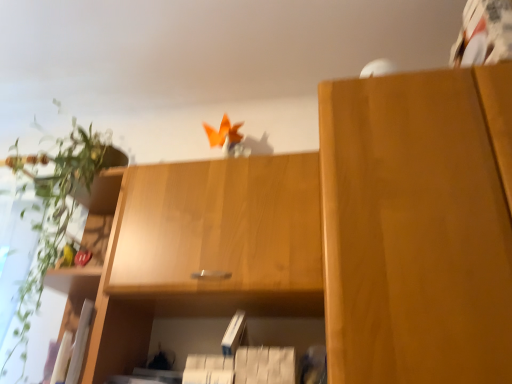
Question: In terms of width, does matte wood cabinet at right, which ranks as the 2th cabinetry in left-to-right order, look wider or thinner when compared to white matte paperback book at center?

Choices:
 (A) thin
 (B) wide

Answer: (B)

Question: From the image's perspective, is matte wood cabinet at right, which ranks as the 2th cabinetry in left-to-right order, above or below white matte paperback book at center?

Choices:
 (A) below
 (B) above

Answer: (B)

Question: Estimate the real-world distances between objects in this image. Which object is closer to the light brown wood cabinet at upper center, the 1th cabinetry from the left?

Choices:
 (A) green leafy plant at left
 (B) white matte paperback book at center
 (C) matte wood cabinet at right, which ranks as the 2th cabinetry in left-to-right order

Answer: (B)

Question: Estimate the real-world distances between objects in this image. Which object is closer to the green leafy plant at left?

Choices:
 (A) matte wood cabinet at right, which ranks as the 2th cabinetry in left-to-right order
 (B) white matte paperback book at center
 (C) light brown wood cabinet at upper center, arranged as the second cabinetry when viewed from the right

Answer: (C)